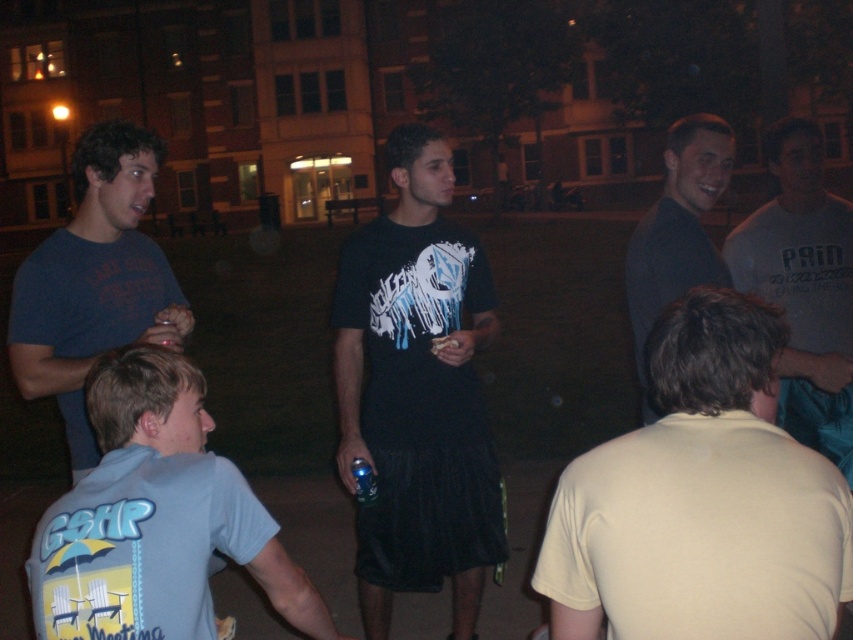
Question: From the image, what is the correct spatial relationship of yellow matte shirt at center in relation to black matte t-shirt at center?

Choices:
 (A) right
 (B) left

Answer: (A)

Question: Can you confirm if matte blue t-shirt at left is wider than blue plastic cup at center?

Choices:
 (A) yes
 (B) no

Answer: (A)

Question: Which object appears farthest from the camera in this image?

Choices:
 (A) light blue t-shirt at lower left
 (B) matte blue t-shirt at left

Answer: (B)

Question: Which of the following is the farthest from the observer?

Choices:
 (A) dark blue shirt at upper right
 (B) gray cotton t-shirt at upper right
 (C) black matte t-shirt at center

Answer: (C)

Question: Is matte blue t-shirt at left wider than dark blue shirt at upper right?

Choices:
 (A) yes
 (B) no

Answer: (A)

Question: Estimate the real-world distances between objects in this image. Which object is farther from the dark blue shirt at upper right?

Choices:
 (A) light blue t-shirt at lower left
 (B) black matte t-shirt at center

Answer: (A)